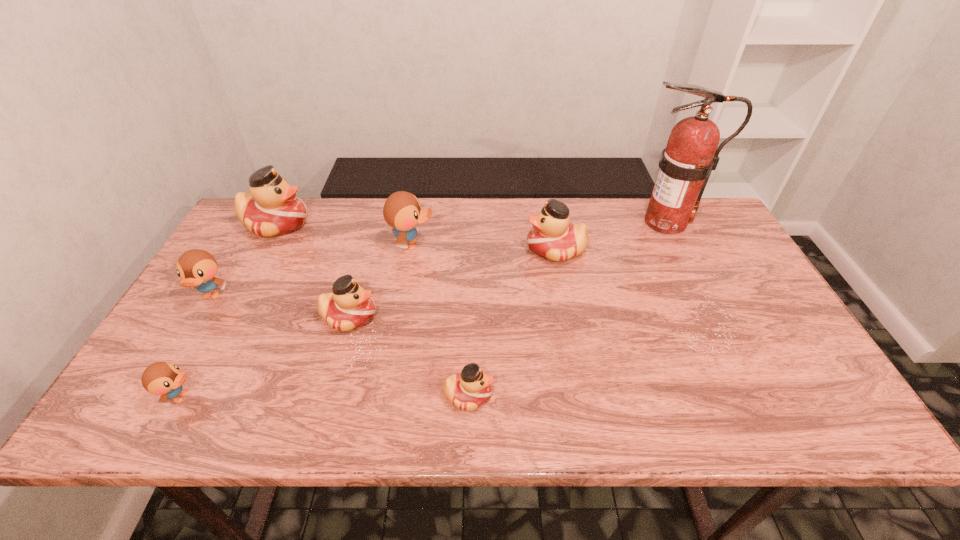
The image size is (960, 540). I want to click on free space at the far edge, so click(x=458, y=222).

Identify the location of free point at the near edge. This screenshot has width=960, height=540. (232, 396).

You are a GUI agent. You are given a task and a screenshot of the screen. Output one action in this format:
    pyautogui.click(x=<x>, y=<y>)
    Task: Click on the vacant region at the left edge of the desktop
    The width and height of the screenshot is (960, 540).
    Given the screenshot: What is the action you would take?
    pyautogui.click(x=193, y=314)

You are a GUI agent. You are given a task and a screenshot of the screen. Output one action in this format:
    pyautogui.click(x=<x>, y=<y>)
    Task: Click on the vacant space at the right edge of the desktop
    The height and width of the screenshot is (540, 960).
    Given the screenshot: What is the action you would take?
    [x=711, y=294]

I want to click on vacant space that's between the biggest red duck and the rightmost duck, so click(417, 237).

Where is `free spot between the biggest red duck and the second nearest blue duck`? The image size is (960, 540). free spot between the biggest red duck and the second nearest blue duck is located at coordinates (244, 260).

Find the location of a particular element. vacant space that's between the second farthest blue duck and the smallest blue duck is located at coordinates (196, 347).

The image size is (960, 540). Identify the location of free point between the biggest blue duck and the biggest red duck. (345, 234).

Where is `vacant region between the second biggest blue duck and the second red duck from right to left`? This screenshot has width=960, height=540. vacant region between the second biggest blue duck and the second red duck from right to left is located at coordinates (340, 346).

Where is `free space between the smallest blue duck and the rightmost duck`? Image resolution: width=960 pixels, height=540 pixels. free space between the smallest blue duck and the rightmost duck is located at coordinates (369, 323).